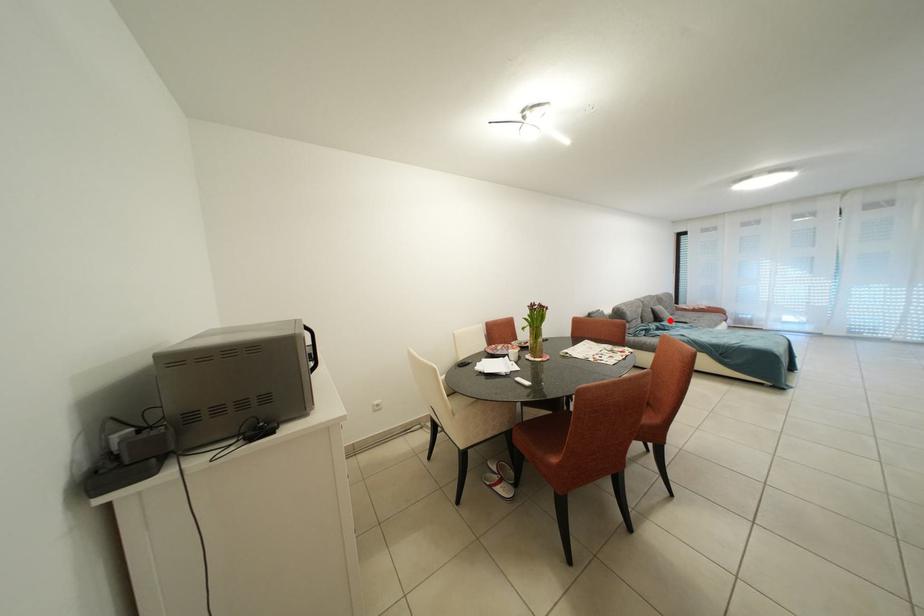
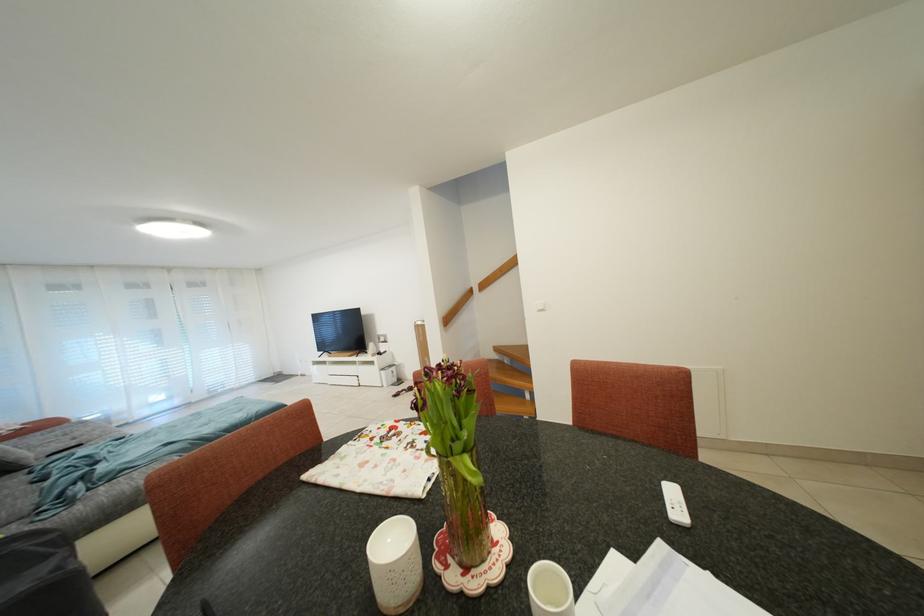
Locate, in the second image, the point that corresponds to the highlighted location in the first image.

(19, 462)